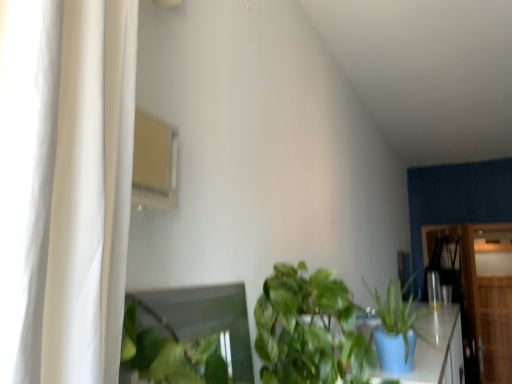
Question: Is matte blue pot at lower right, the second houseplant when ordered from left to right, bigger or smaller than wooden dresser at right, which ranks as the second dresser in right-to-left order?

Choices:
 (A) big
 (B) small

Answer: (B)

Question: Does point (414, 352) appear closer or farther from the camera than point (430, 249)?

Choices:
 (A) farther
 (B) closer

Answer: (B)

Question: Which is nearer to the wooden dresser at right, the second dresser from the back?

Choices:
 (A) wooden dresser at right, positioned as the 2th dresser in left-to-right order
 (B) green leafy plant at center, marked as the first houseplant in a left-to-right arrangement
 (C) matte blue pot at lower right, the 1th houseplant from the right

Answer: (A)

Question: Based on their relative distances, which object is nearer to the wooden dresser at right, positioned as the 2th dresser in left-to-right order?

Choices:
 (A) green leafy plant at center, placed as the second houseplant when sorted from right to left
 (B) wooden dresser at right, the second dresser from the back
 (C) matte blue pot at lower right, the 1th houseplant from the right

Answer: (B)